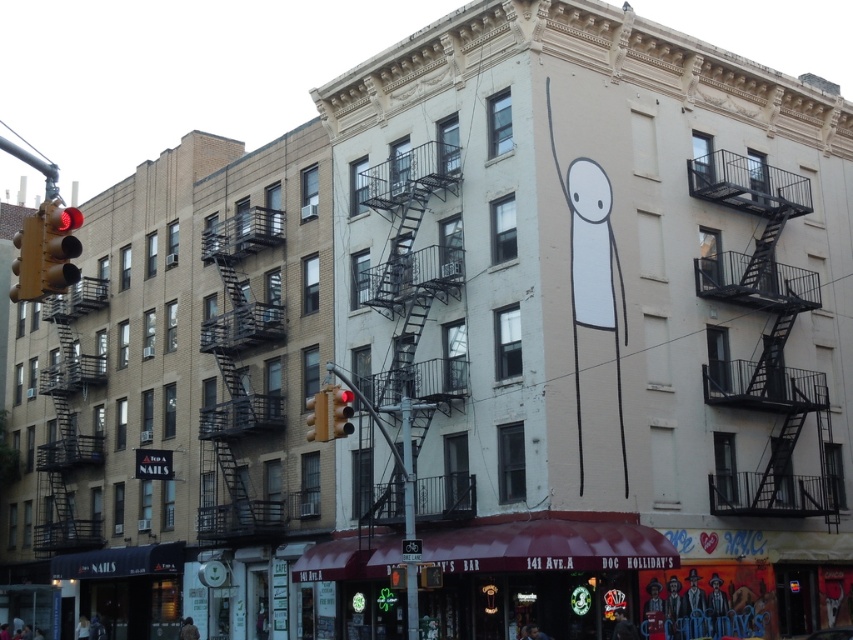
Question: Can you confirm if black metal fire escape at right is thinner than metallic pole at center?

Choices:
 (A) no
 (B) yes

Answer: (A)

Question: Which of the following is the closest to the observer?

Choices:
 (A) (338, 394)
 (B) (811, 294)

Answer: (A)

Question: Which point is farther to the camera?

Choices:
 (A) metallic yellow traffic light at left
 (B) red glass traffic light at center

Answer: (B)

Question: Can you confirm if black metal fire escape at right is positioned to the left of metallic pole at center?

Choices:
 (A) no
 (B) yes

Answer: (A)

Question: Is black metal fire escape at right smaller than red glass traffic light at center?

Choices:
 (A) no
 (B) yes

Answer: (A)

Question: Estimate the real-world distances between objects in this image. Which object is closer to the red glass traffic light at center?

Choices:
 (A) metallic yellow traffic light at center
 (B) black metal fire escape at right
 (C) metallic yellow traffic light at left
 (D) metallic pole at center

Answer: (D)